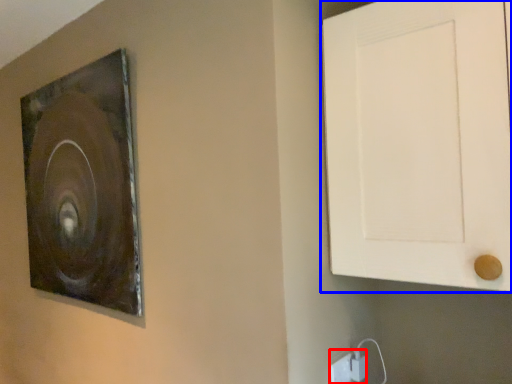
Question: Among these objects, which one is nearest to the camera, electric outlet (highlighted by a red box) or door (highlighted by a blue box)?

Choices:
 (A) electric outlet
 (B) door

Answer: (B)